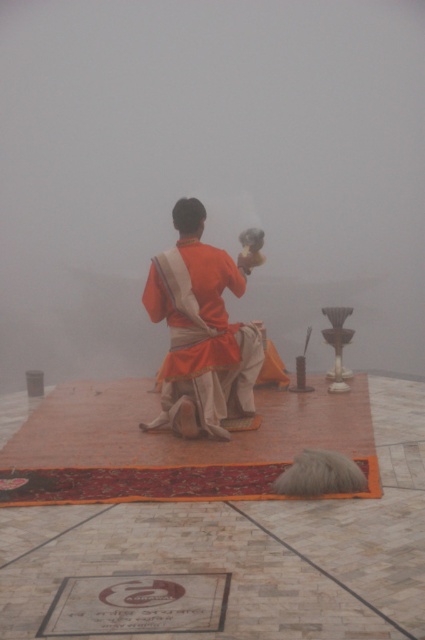
Does foggy mist at center have a lesser width compared to matte orange robe at center?

In fact, foggy mist at center might be wider than matte orange robe at center.

Who is positioned more to the left, foggy mist at center or matte orange robe at center?

matte orange robe at center is more to the left.

Does point (48, 218) lie in front of point (181, 253)?

That is False.

Find the location of a particular element. This screenshot has height=640, width=425. foggy mist at center is located at coordinates (209, 172).